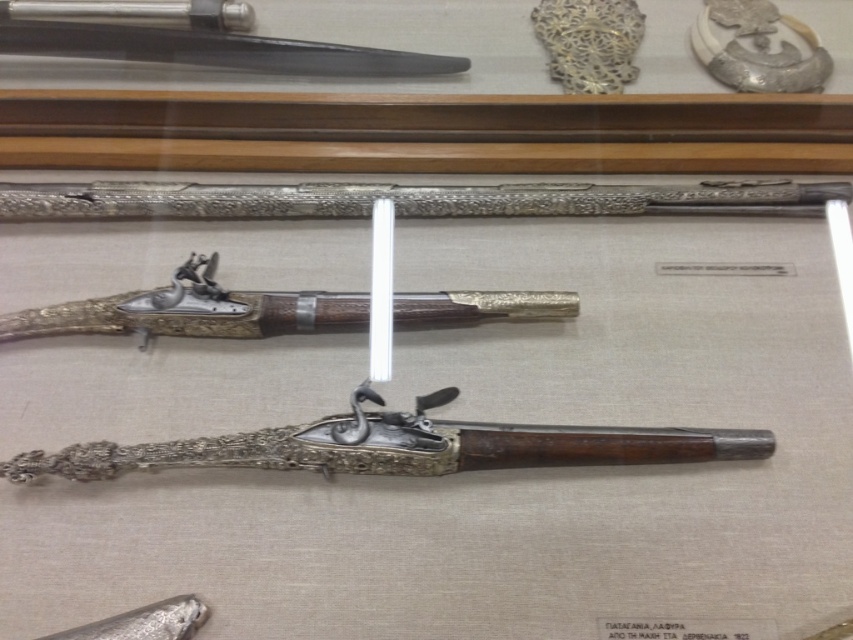
Question: Can you confirm if polished silver rifle at center is positioned to the right of polished silver rifle at upper center?

Choices:
 (A) no
 (B) yes

Answer: (B)

Question: Can you confirm if polished silver rifle at center is positioned to the left of polished silver rifle at upper center?

Choices:
 (A) no
 (B) yes

Answer: (A)

Question: Which point is farther to the camera?

Choices:
 (A) (3, 44)
 (B) (201, 444)

Answer: (A)

Question: Which point appears closest to the camera in this image?

Choices:
 (A) (709, 449)
 (B) (107, 29)

Answer: (A)

Question: Is polished silver rifle at center to the left of polished silver rifle at upper center from the viewer's perspective?

Choices:
 (A) no
 (B) yes

Answer: (A)